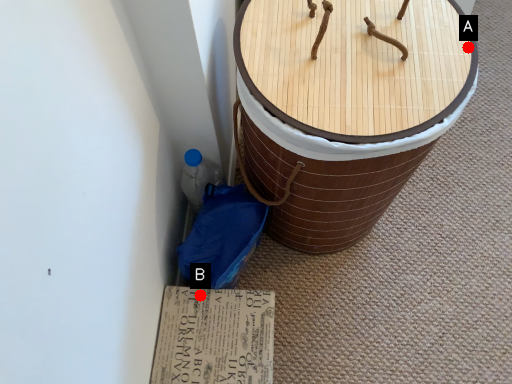
Question: Two points are circled on the image, labeled by A and B beside each circle. Which point is closer to the camera taking this photo?

Choices:
 (A) A is closer
 (B) B is closer

Answer: (A)